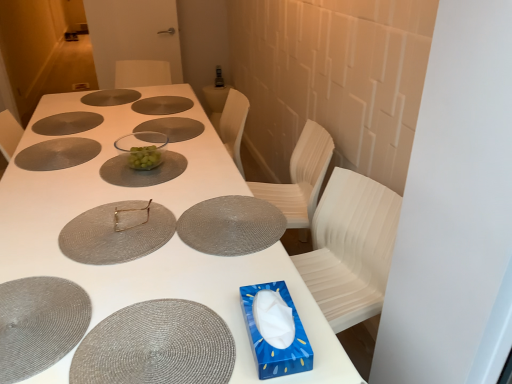
Locate an element on the screen. This screenshot has width=512, height=384. empty space that is ontop of matte gray placemat at center, the 8th glass plate positioned from the back (from a real-world perspective) is located at coordinates (114, 223).